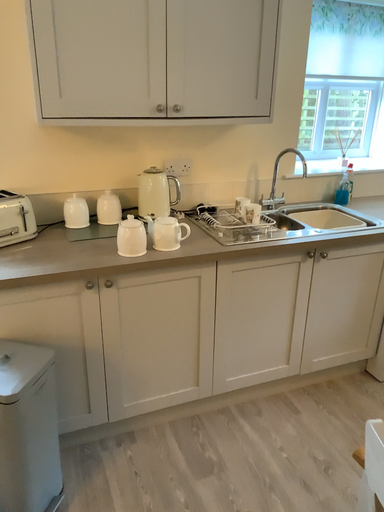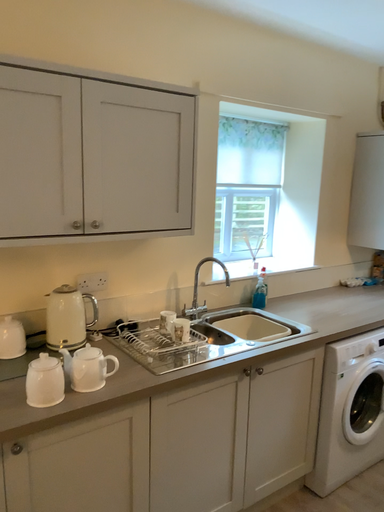
Question: Which way did the camera rotate in the video?

Choices:
 (A) rotated left
 (B) rotated right

Answer: (B)